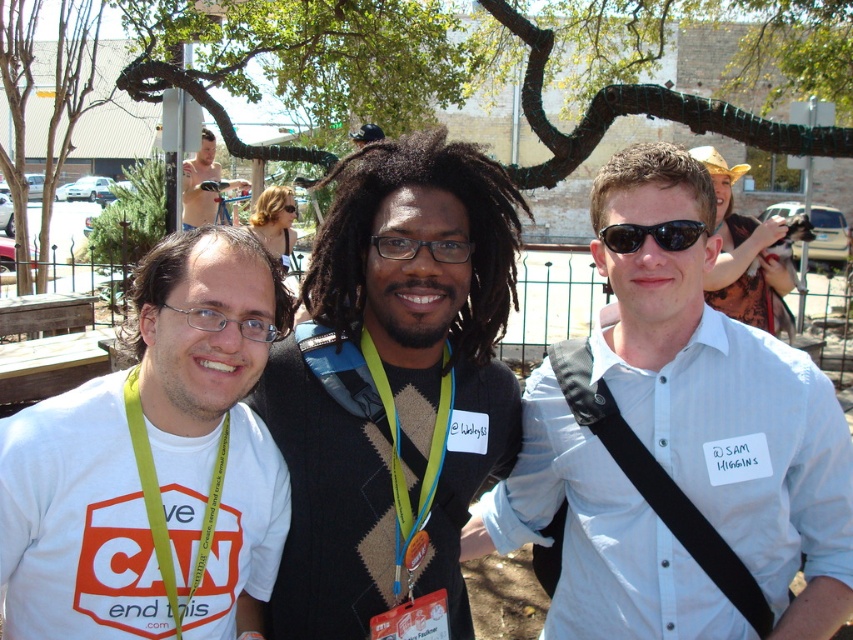
Question: Is white striped shirt at center to the left of white matte t-shirt at left from the viewer's perspective?

Choices:
 (A) yes
 (B) no

Answer: (B)

Question: Which object is farther from the camera taking this photo?

Choices:
 (A) black plastic sunglasses at center
 (B) brown sweater at center
 (C) white striped shirt at center
 (D) black plastic glasses at center

Answer: (C)

Question: Considering the real-world distances, which object is farthest from the brown sweater at center?

Choices:
 (A) white shirt at center
 (B) brown knitted sweater at center

Answer: (A)

Question: Is brown sweater at center below shiny metallic body at upper left?

Choices:
 (A) yes
 (B) no

Answer: (A)

Question: Is brown knitted sweater at center above black plastic goggles at upper center?

Choices:
 (A) no
 (B) yes

Answer: (A)

Question: Estimate the real-world distances between objects in this image. Which object is farther from the white shirt at center?

Choices:
 (A) brown knitted sweater at center
 (B) green fabric lanyard at left
 (C) white matte neck at center

Answer: (B)